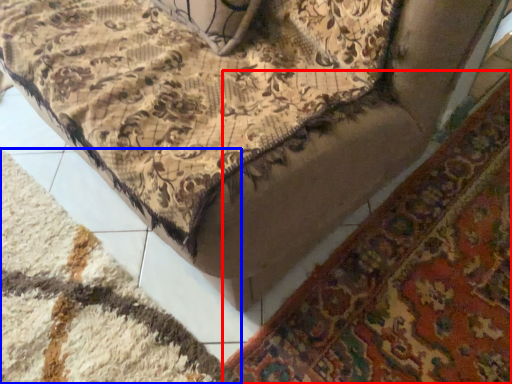
Question: Which of the following is the farthest to the observer, mat (highlighted by a red box) or mat (highlighted by a blue box)?

Choices:
 (A) mat
 (B) mat

Answer: (A)